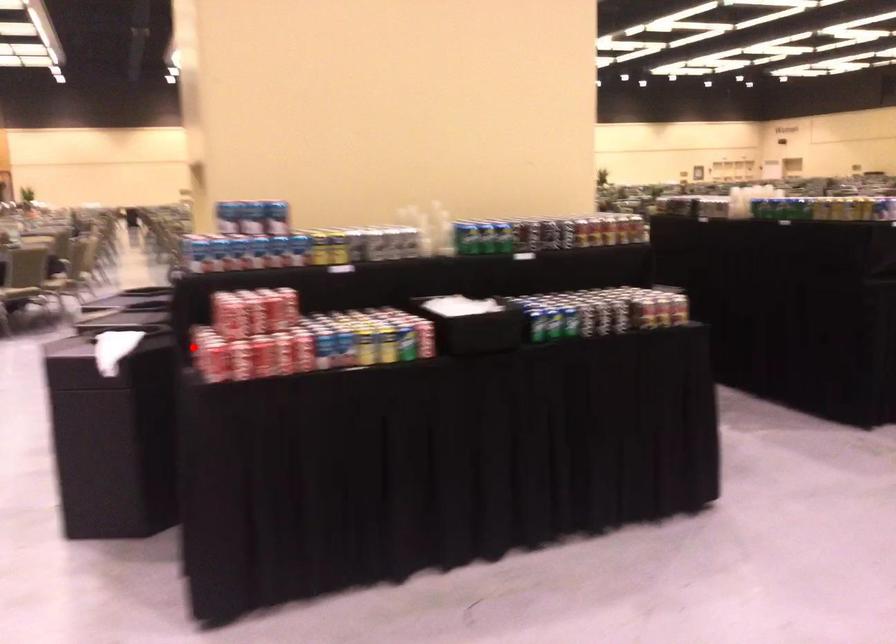
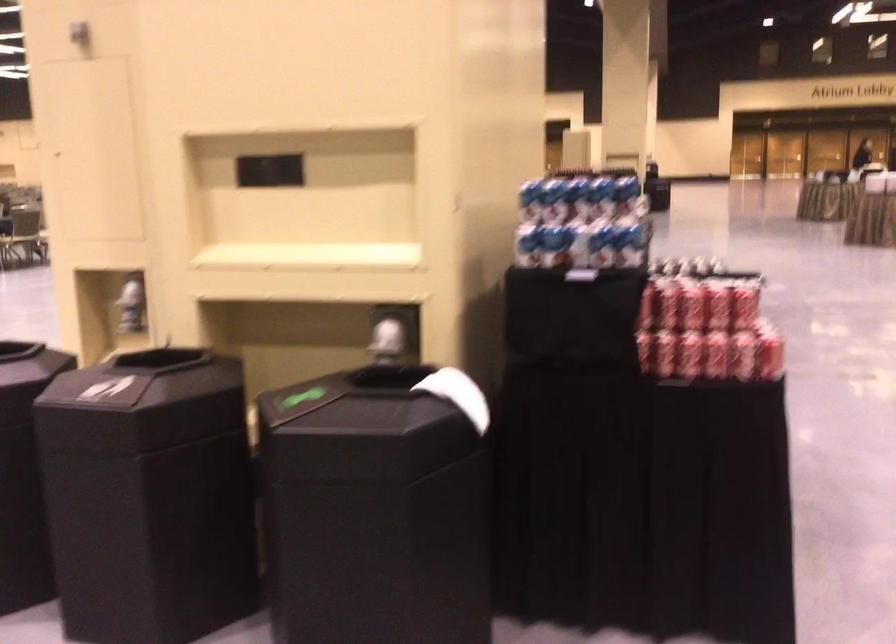
Question: I am providing you with two images of the same scene from different viewpoints. Image1 has a red point marked. In image2, the corresponding 3D location appears at what relative position? Reply with the corresponding letter.

Choices:
 (A) Closer
 (B) Farther

Answer: (A)